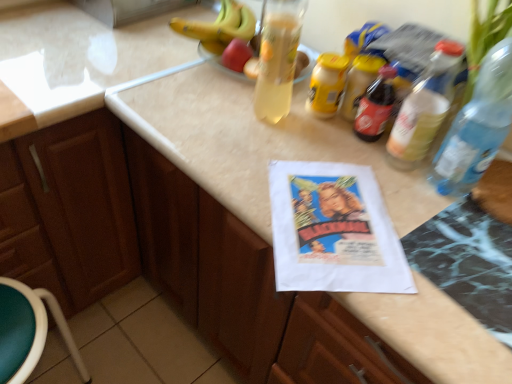
Question: In terms of height, does brown wood cabinet at left look taller or shorter compared to transparent plastic bottle at right, the 1th bottle when ordered from right to left?

Choices:
 (A) short
 (B) tall

Answer: (B)

Question: Relative to transparent plastic bottle at right, the 1th bottle when ordered from right to left, is brown wood cabinet at left in front or behind?

Choices:
 (A) front
 (B) behind

Answer: (B)

Question: Considering the real-world distances, which object is closest to the brown wood cabinet at left?

Choices:
 (A) translucent plastic bottle at upper right, which is the first bottle in left-to-right order
 (B) transparent plastic bottle at right, the 1th bottle when ordered from right to left
 (C) green plastic stool at lower left

Answer: (C)

Question: Considering the real-world distances, which object is farthest from the brown wood cabinet at left?

Choices:
 (A) transparent plastic bottle at right, the second bottle positioned from the left
 (B) translucent plastic bottle at upper right, which is the first bottle in left-to-right order
 (C) green plastic stool at lower left

Answer: (A)